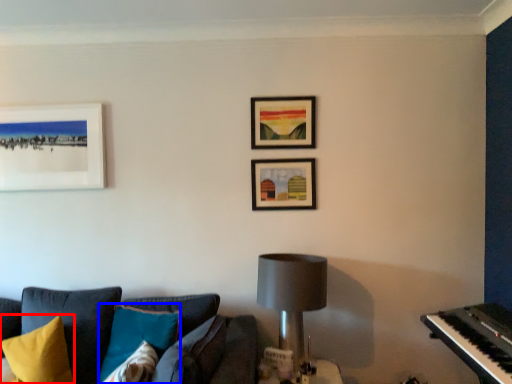
Question: Which of the following is the farthest to the observer, pillow (highlighted by a red box) or pillow (highlighted by a blue box)?

Choices:
 (A) pillow
 (B) pillow

Answer: (A)